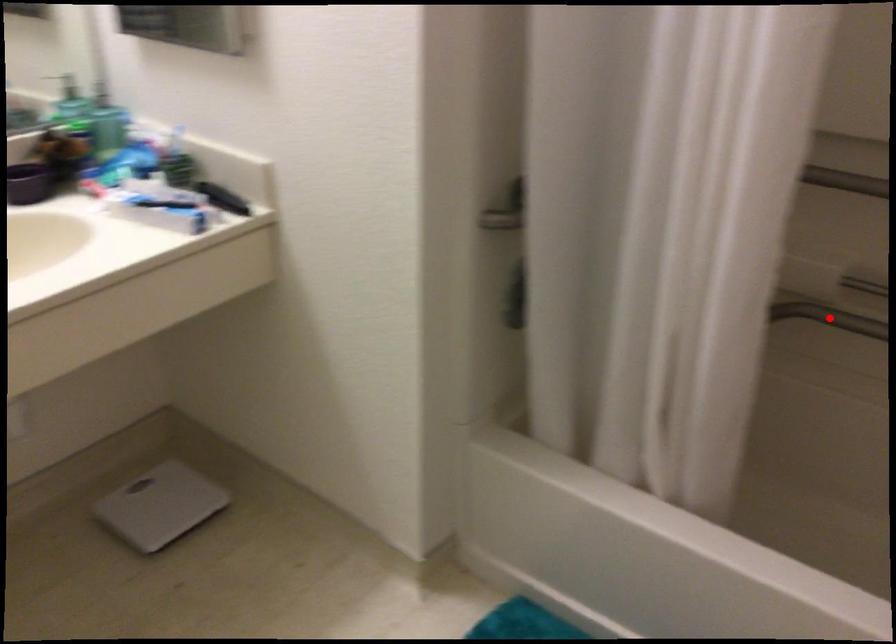
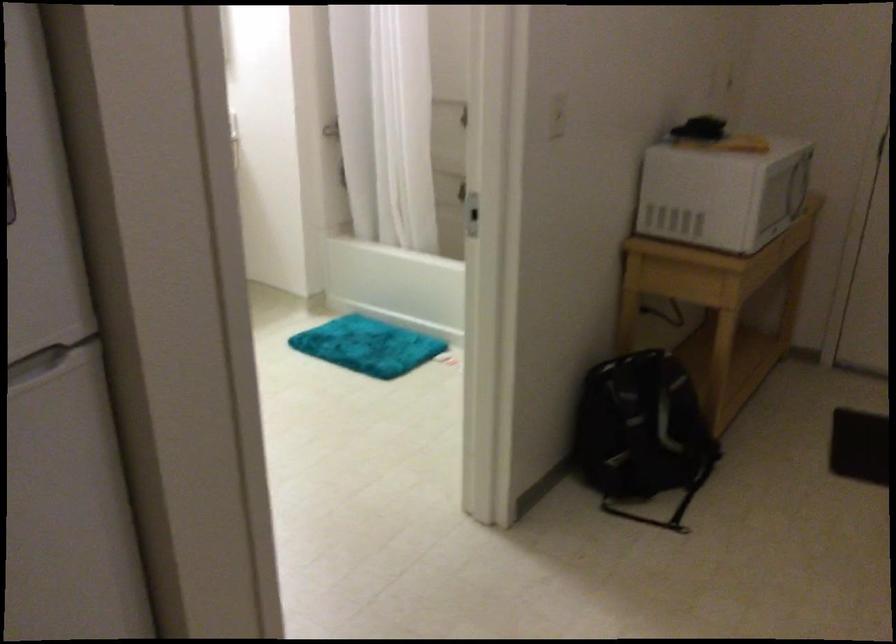
Question: I am providing you with two images of the same scene from different viewpoints. A red point is marked on the first image. Is the red point's position out of view in image 2?

Choices:
 (A) Yes
 (B) No

Answer: (A)